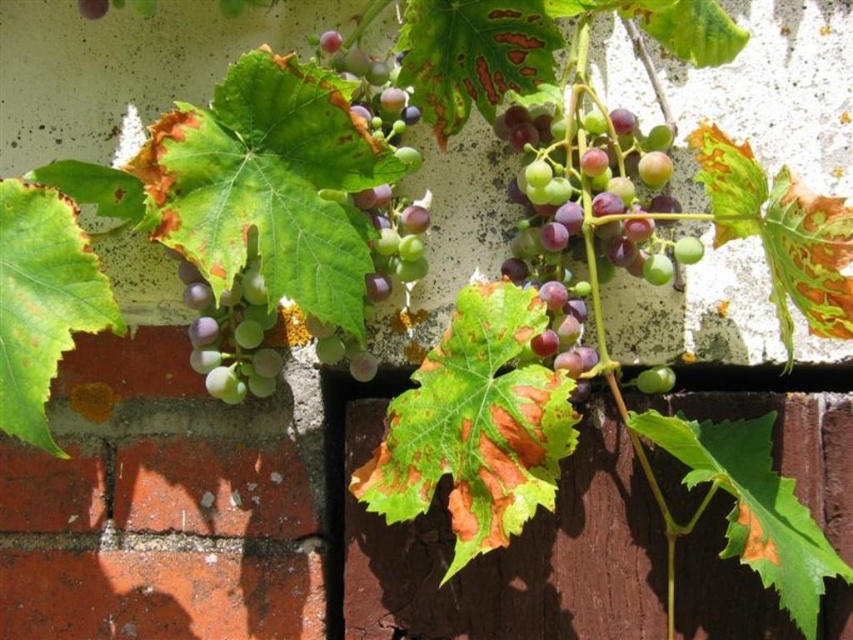
Is purple matte grapes at center to the right of green matte grapes at upper center from the viewer's perspective?

Correct, you'll find purple matte grapes at center to the right of green matte grapes at upper center.

Who is higher up, purple matte grapes at center or green matte grapes at upper center?

green matte grapes at upper center

Locate an element on the screen. This screenshot has width=853, height=640. purple matte grapes at center is located at coordinates (583, 220).

Is green matte grapes at upper center below matte purple grapes at center-left?

No, green matte grapes at upper center is not below matte purple grapes at center-left.

Which is more to the right, green matte grapes at upper center or matte purple grapes at center-left?

From the viewer's perspective, green matte grapes at upper center appears more on the right side.

The height and width of the screenshot is (640, 853). Find the location of `green matte grapes at upper center`. green matte grapes at upper center is located at coordinates (392, 236).

Between purple matte grapes at center and green matte grape at center, which one appears on the right side from the viewer's perspective?

From the viewer's perspective, green matte grape at center appears more on the right side.

Is purple matte grapes at center to the left of green matte grape at center from the viewer's perspective?

Indeed, purple matte grapes at center is positioned on the left side of green matte grape at center.

Which is in front, point (560, 170) or point (653, 392)?

Point (560, 170) is more forward.

Locate an element on the screen. purple matte grapes at center is located at coordinates (583, 220).